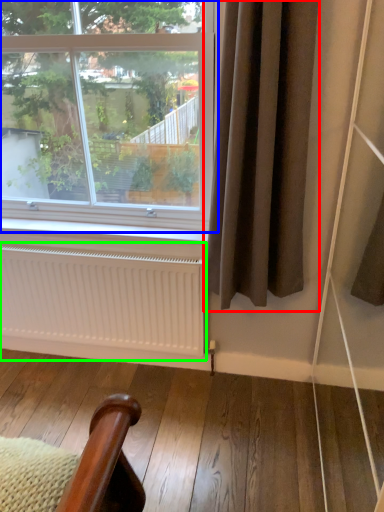
Question: Based on their relative distances, which object is farther from curtain (highlighted by a red box)? Choose from window (highlighted by a blue box) and radiator (highlighted by a green box).

Choices:
 (A) window
 (B) radiator

Answer: (A)